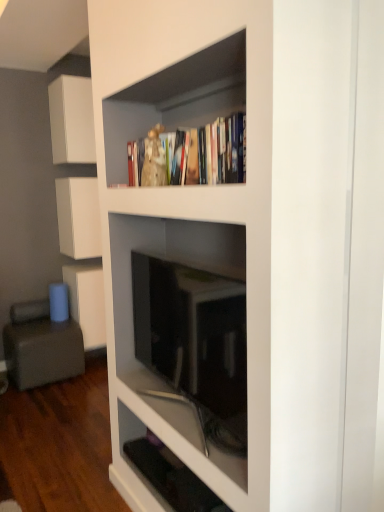
Locate an element on the screen. The width and height of the screenshot is (384, 512). free space above black glossy shelf at lower center, positioned as the 1th shelf in bottom-to-top order (from a real-world perspective) is located at coordinates (158, 476).